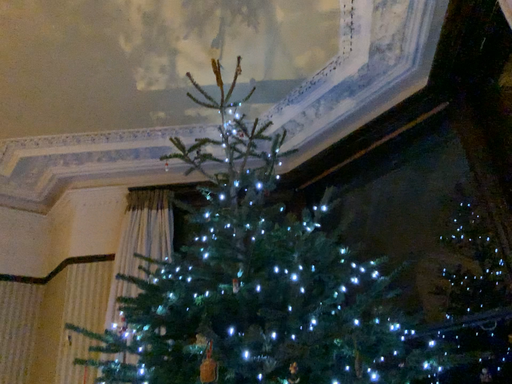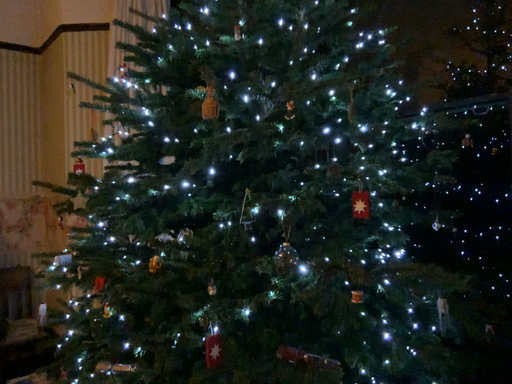
Question: How did the camera likely rotate when shooting the video?

Choices:
 (A) rotated downward
 (B) rotated upward

Answer: (A)